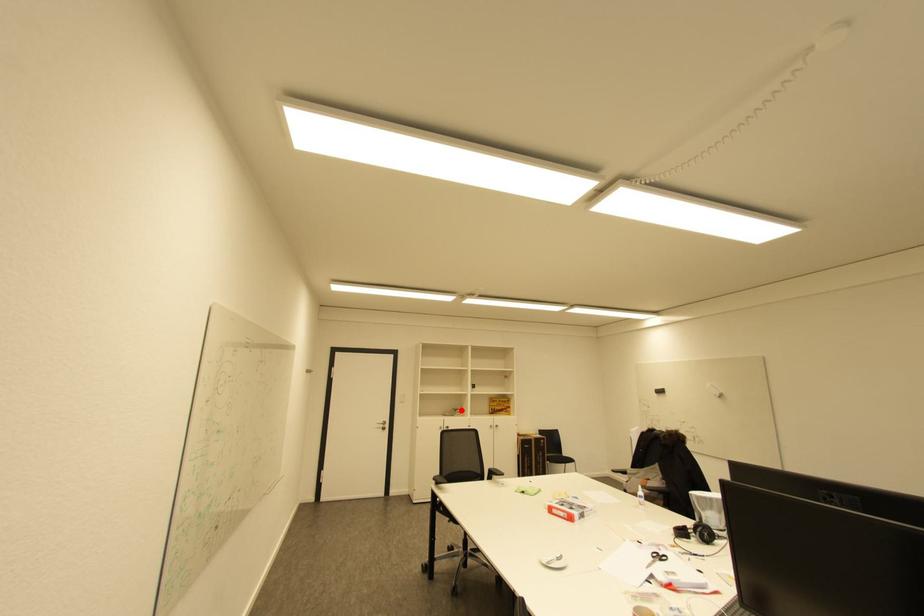
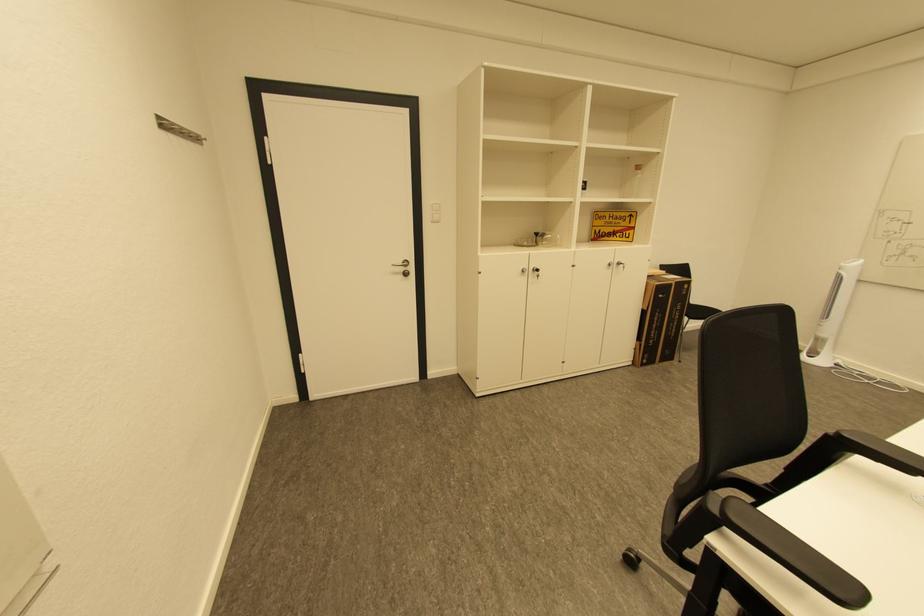
Question: I am providing you with two images of the same scene from different viewpoints. In image1, a red point is highlighted. Considering the same 3D point in image2, which of the following is correct?

Choices:
 (A) It is closer
 (B) It is farther

Answer: (A)